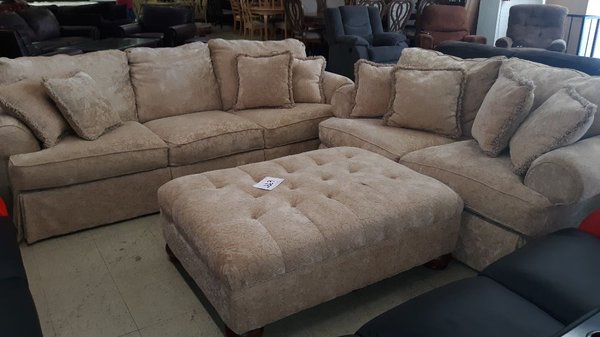
Locate an element on the screen. Image resolution: width=600 pixels, height=337 pixels. tiles is located at coordinates (96, 306), (162, 294), (331, 328).